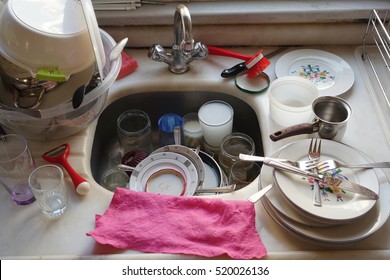
You are a GUI agent. You are given a task and a screenshot of the screen. Output one action in this format:
    pyautogui.click(x=<x>, y=<y>)
    Task: Click on the fork
    
    Given the screenshot: What is the action you would take?
    pyautogui.click(x=272, y=169)